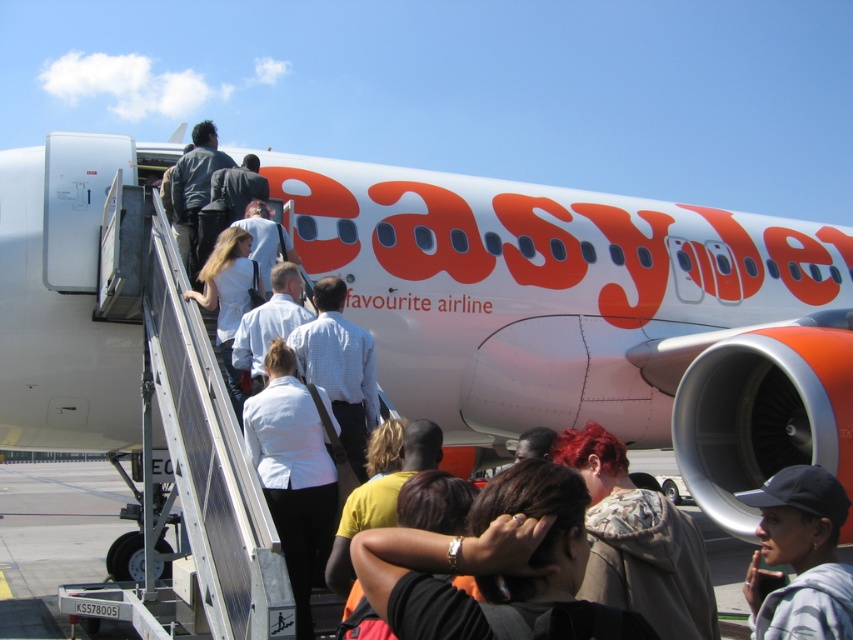
Question: Which point is farther to the camera?

Choices:
 (A) white matte shirt at center
 (B) dark brown hair at center

Answer: (A)

Question: Does fluffy hoodie at center have a greater width compared to gray fabric cap at lower right?

Choices:
 (A) no
 (B) yes

Answer: (B)

Question: From the image, what is the correct spatial relationship of white matte shirt at center in relation to gray fabric cap at lower right?

Choices:
 (A) above
 (B) below

Answer: (A)

Question: Estimate the real-world distances between objects in this image. Which object is farther from the dark brown hair at center?

Choices:
 (A) fluffy hoodie at center
 (B) white matte shirt at center
 (C) gray fabric cap at lower right

Answer: (B)

Question: Which of the following is the closest to the observer?

Choices:
 (A) white matte shirt at center
 (B) gray fabric cap at lower right

Answer: (B)

Question: From the image, what is the correct spatial relationship of dark brown hair at center in relation to fluffy hoodie at center?

Choices:
 (A) above
 (B) below

Answer: (A)